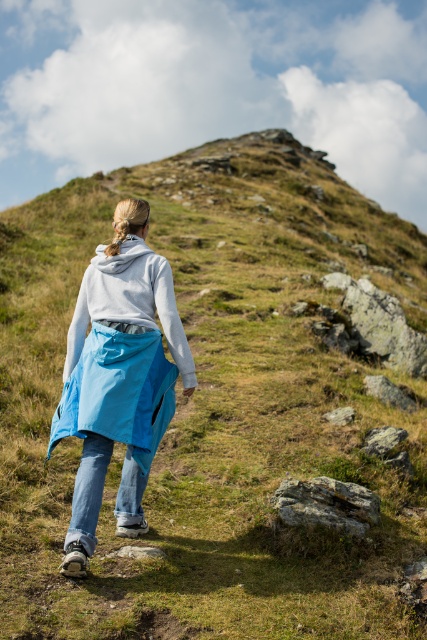
You are the hiker in the image and you want to place your water bottle on a flat surface. Which object can you use as a surface, the light gray fleece sweatshirt at center or the gray rough rock at lower center?

The gray rough rock at lower center can be used as a flat surface because it is a solid object, while the light gray fleece sweatshirt at center is a soft fabric that might not provide a stable surface.

You are the hiker in the image and want to remove your jacket to adjust your backpack. Which item should you take off first, the matte blue raincoat at center or the light gray fleece sweatshirt at center?

The matte blue raincoat at center is in front of the light gray fleece sweatshirt at center, so you should take off the matte blue raincoat at center first.